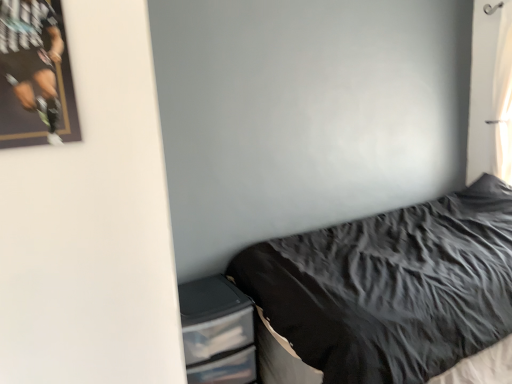
Question: Is white sheer curtain at upper right at the back of black textured fabric at lower right?

Choices:
 (A) no
 (B) yes

Answer: (A)

Question: From a real-world perspective, is black textured fabric at lower right positioned under white sheer curtain at upper right based on gravity?

Choices:
 (A) no
 (B) yes

Answer: (B)

Question: Is the depth of black textured fabric at lower right greater than that of white sheer curtain at upper right?

Choices:
 (A) yes
 (B) no

Answer: (B)

Question: Considering the relative sizes of black textured fabric at lower right and white sheer curtain at upper right in the image provided, is black textured fabric at lower right smaller than white sheer curtain at upper right?

Choices:
 (A) yes
 (B) no

Answer: (B)

Question: Does black textured fabric at lower right contain white sheer curtain at upper right?

Choices:
 (A) yes
 (B) no

Answer: (B)

Question: Is point (15, 94) positioned closer to the camera than point (466, 263)?

Choices:
 (A) closer
 (B) farther

Answer: (A)

Question: Based on their positions, is matte black poster at upper left located to the left or right of black textured fabric at lower right?

Choices:
 (A) left
 (B) right

Answer: (A)

Question: Considering the positions of matte black poster at upper left and black textured fabric at lower right in the image, is matte black poster at upper left taller or shorter than black textured fabric at lower right?

Choices:
 (A) short
 (B) tall

Answer: (A)

Question: Is matte black poster at upper left bigger or smaller than black textured fabric at lower right?

Choices:
 (A) small
 (B) big

Answer: (A)

Question: Considering the positions of black textured fabric at lower right and clear plastic drawers at lower left in the image, is black textured fabric at lower right wider or thinner than clear plastic drawers at lower left?

Choices:
 (A) wide
 (B) thin

Answer: (A)

Question: From the image's perspective, relative to clear plastic drawers at lower left, is black textured fabric at lower right above or below?

Choices:
 (A) above
 (B) below

Answer: (A)

Question: Is point (406, 307) positioned closer to the camera than point (201, 332)?

Choices:
 (A) farther
 (B) closer

Answer: (B)

Question: In the image, is black textured fabric at lower right on the left side or the right side of clear plastic drawers at lower left?

Choices:
 (A) right
 (B) left

Answer: (A)

Question: Is black textured fabric at lower right bigger or smaller than matte black poster at upper left?

Choices:
 (A) big
 (B) small

Answer: (A)

Question: From a real-world perspective, is black textured fabric at lower right physically located above or below matte black poster at upper left?

Choices:
 (A) below
 (B) above

Answer: (A)